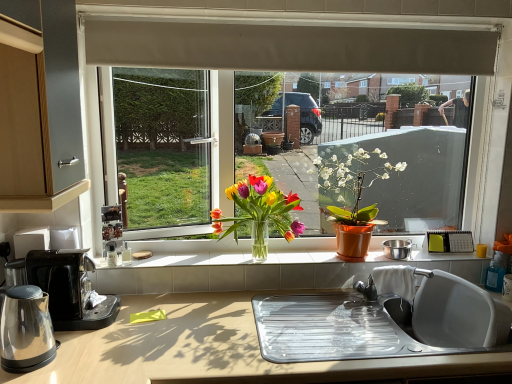
I want to click on black plastic coffee maker at lower left, so click(70, 289).

Find the location of a particular element. Image resolution: width=512 pixels, height=384 pixels. matte orange pot at center, acting as the 1th houseplant starting from the right is located at coordinates (x=354, y=198).

At what (x,y) coordinates should I click in order to perform the action: click on translucent glass vase at center, which is the 2th houseplant in right-to-left order. Please return your answer as a coordinate pair (x, y). This screenshot has height=384, width=512. Looking at the image, I should click on (259, 213).

From their relative heights in the image, would you say beige fabric exhaust hood at upper center is taller or shorter than white glossy vase at center?

Considering their sizes, beige fabric exhaust hood at upper center has more height than white glossy vase at center.

Considering the sizes of beige fabric exhaust hood at upper center and white glossy vase at center in the image, is beige fabric exhaust hood at upper center wider or thinner than white glossy vase at center?

Clearly, beige fabric exhaust hood at upper center has less width compared to white glossy vase at center.

Who is bigger, beige fabric exhaust hood at upper center or white glossy vase at center?

With larger size is beige fabric exhaust hood at upper center.

How distant is shiny metallic kettle at left from metallic stainless steel pot at center?

shiny metallic kettle at left is 1.51 meters away from metallic stainless steel pot at center.

Is shiny metallic kettle at left positioned beyond the bounds of metallic stainless steel pot at center?

Yes, shiny metallic kettle at left is outside of metallic stainless steel pot at center.

Considering the relative sizes of shiny metallic kettle at left and metallic stainless steel pot at center in the image provided, is shiny metallic kettle at left thinner than metallic stainless steel pot at center?

No.

From the image's perspective, which one is positioned lower, shiny metallic kettle at left or metallic stainless steel pot at center?

shiny metallic kettle at left is shown below in the image.

Is yellow plastic corded phone at right aimed at black plastic coffee maker at lower left?

No.

Choose the correct answer: Is yellow plastic corded phone at right inside black plastic coffee maker at lower left or outside it?

yellow plastic corded phone at right is spatially situated outside black plastic coffee maker at lower left.

At what (x,y) coordinates should I click in order to perform the action: click on corded phone located above the black plastic coffee maker at lower left (from the image's perspective). Please return your answer as a coordinate pair (x, y). The width and height of the screenshot is (512, 384). Looking at the image, I should click on (450, 242).

Is yellow plastic corded phone at right closer to camera compared to black plastic coffee maker at lower left?

No, yellow plastic corded phone at right is further to the viewer.

From the image's perspective, which is above, black plastic coffee maker at lower left or transparent glass window at center?

transparent glass window at center, from the image's perspective.

Which object is positioned more to the left, black plastic coffee maker at lower left or transparent glass window at center?

black plastic coffee maker at lower left is more to the left.

Would you say transparent glass window at center is part of black plastic coffee maker at lower left's contents?

No, transparent glass window at center is not a part of black plastic coffee maker at lower left.

Which is behind, point (48, 254) or point (223, 18)?

The point (223, 18) is behind.

Image resolution: width=512 pixels, height=384 pixels. In order to click on window above the white glossy vase at center (from the image's perspective) in this screenshot , I will do `click(284, 53)`.

Would you say transparent glass window at center is to the left or to the right of white glossy vase at center in the picture?

Based on their positions, transparent glass window at center is located to the left of white glossy vase at center.

How much distance is there between transparent glass window at center and white glossy vase at center?

A distance of 28.57 inches exists between transparent glass window at center and white glossy vase at center.

Is transparent glass window at center wider or thinner than white glossy vase at center?

Considering their sizes, transparent glass window at center looks slimmer than white glossy vase at center.

Who is smaller, yellow plastic corded phone at right or shiny metallic kettle at left?

With smaller size is yellow plastic corded phone at right.

Would you consider yellow plastic corded phone at right to be distant from shiny metallic kettle at left?

Yes.

Is yellow plastic corded phone at right surrounding shiny metallic kettle at left?

No, shiny metallic kettle at left is not inside yellow plastic corded phone at right.

Consider the image. Which is farther from the camera, [430,236] or [10,345]?

The point [430,236] is farther.

Is metallic stainless steel pot at center facing towards yellow plastic corded phone at right?

No, metallic stainless steel pot at center does not turn towards yellow plastic corded phone at right.

From the image's perspective, which one is positioned lower, metallic stainless steel pot at center or yellow plastic corded phone at right?

metallic stainless steel pot at center, from the image's perspective.

You are a GUI agent. You are given a task and a screenshot of the screen. Output one action in this format:
    pyautogui.click(x=<x>, y=<y>)
    Task: Click on the appliance that appears below the yellow plastic corded phone at right (from the image's perspective)
    The image size is (512, 384).
    Given the screenshot: What is the action you would take?
    pyautogui.click(x=397, y=249)

Does metallic stainless steel pot at center contain yellow plastic corded phone at right?

No.

In order to click on window sill directly beneath the beige fabric exhaust hood at upper center (from a real-world perspective) in this screenshot , I will do `click(190, 260)`.

Locate an element on the screen. Image resolution: width=512 pixels, height=384 pixels. appliance behind the shiny metallic kettle at left is located at coordinates (397, 249).

When comparing their distances from beige fabric exhaust hood at upper center, does yellow plastic corded phone at right or translucent glass vase at center, which is the 2th houseplant in right-to-left order, seem closer?

translucent glass vase at center, which is the 2th houseplant in right-to-left order, lies closer to beige fabric exhaust hood at upper center than the other object.

When comparing their distances from yellow plastic corded phone at right, does metallic stainless steel pot at center or beige fabric exhaust hood at upper center seem closer?

metallic stainless steel pot at center is positioned closer to the anchor yellow plastic corded phone at right.

Estimate the real-world distances between objects in this image. Which object is closer to black plastic coffee maker at lower left, yellow plastic corded phone at right or white glossy vase at center?

Among the two, white glossy vase at center is located nearer to black plastic coffee maker at lower left.

Which object lies nearer to the anchor point translucent glass vase at center, placed as the 1th houseplant when sorted from left to right, beige fabric exhaust hood at upper center or yellow plastic corded phone at right?

Among the two, beige fabric exhaust hood at upper center is located nearer to translucent glass vase at center, placed as the 1th houseplant when sorted from left to right.

Estimate the real-world distances between objects in this image. Which object is further from beige fabric exhaust hood at upper center, black plastic coffee maker at lower left or white glossy vase at center?

black plastic coffee maker at lower left.

Considering their positions, is translucent glass vase at center, which is the 2th houseplant in right-to-left order, positioned closer to white glossy vase at center than shiny metallic kettle at left?

Among the two, translucent glass vase at center, which is the 2th houseplant in right-to-left order, is located nearer to white glossy vase at center.

From the picture: Looking at the image, which one is located closer to black plastic coffee maker at lower left, matte orange pot at center, which is counted as the second houseplant, starting from the left, or shiny metallic kettle at left?

shiny metallic kettle at left is closer to black plastic coffee maker at lower left.

Based on their spatial positions, is shiny metallic kettle at left or matte orange pot at center, which is counted as the second houseplant, starting from the left, further from metallic stainless steel pot at center?

Based on the image, shiny metallic kettle at left appears to be further to metallic stainless steel pot at center.

Image resolution: width=512 pixels, height=384 pixels. What are the coordinates of `window that lies between beige fabric exhaust hood at upper center and matte orange pot at center, which is counted as the second houseplant, starting from the left, from top to bottom` in the screenshot? It's located at (284, 53).

Where is `window sill located between transparent glass window at center and metallic stainless steel pot at center in the left-right direction`? Image resolution: width=512 pixels, height=384 pixels. window sill located between transparent glass window at center and metallic stainless steel pot at center in the left-right direction is located at coordinates (190, 260).

This screenshot has width=512, height=384. Identify the location of window between black plastic coffee maker at lower left and beige fabric exhaust hood at upper center from left to right. [x=284, y=53].

Where is `coffee maker situated between shiny metallic kettle at left and metallic stainless steel pot at center from left to right`? coffee maker situated between shiny metallic kettle at left and metallic stainless steel pot at center from left to right is located at coordinates (70, 289).